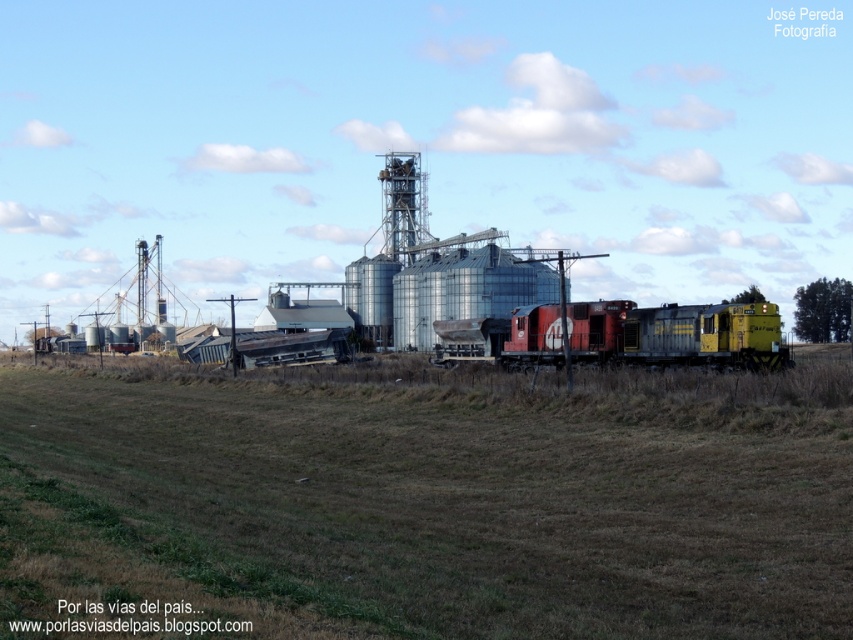
You are standing at the point marked by coordinates point (432,499) in the image. What is the color of the ground beneath you?

The ground at point (432,499) is brown grass at center.